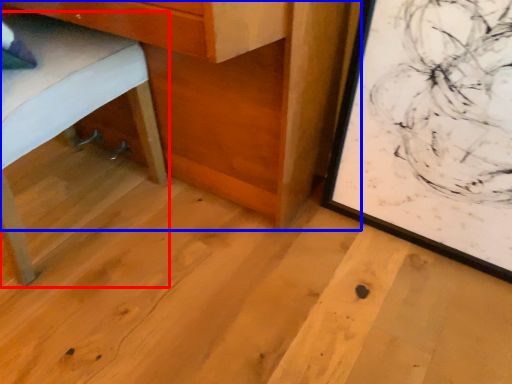
Question: Which of the following is the farthest to the observer, furniture (highlighted by a red box) or table (highlighted by a blue box)?

Choices:
 (A) furniture
 (B) table

Answer: (B)